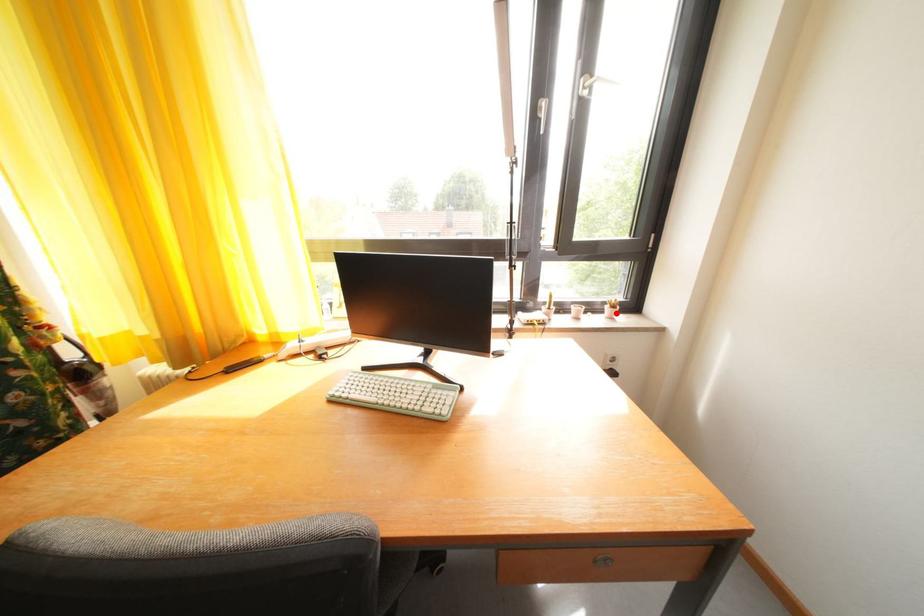
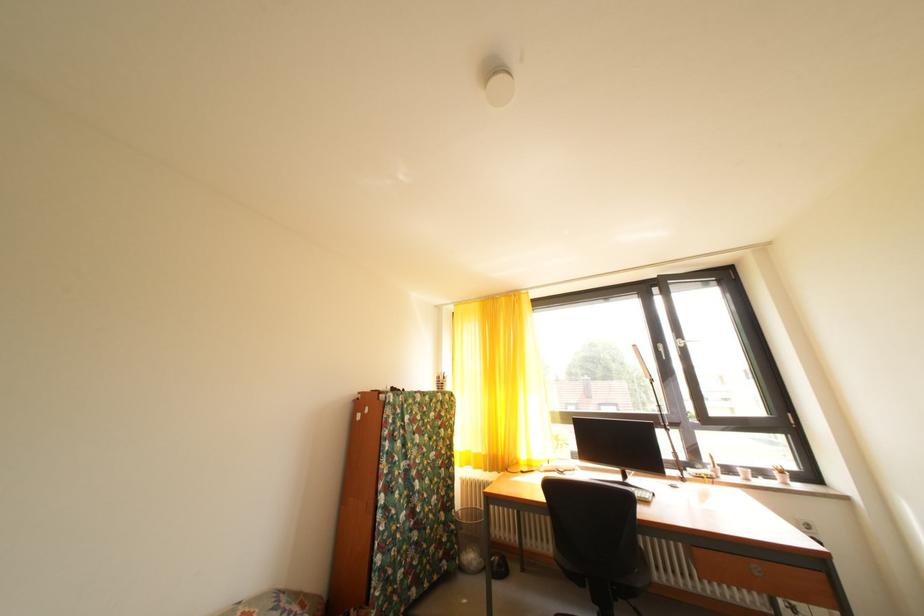
Where in the second image is the point corresponding to the highlighted location from the first image?

(784, 479)